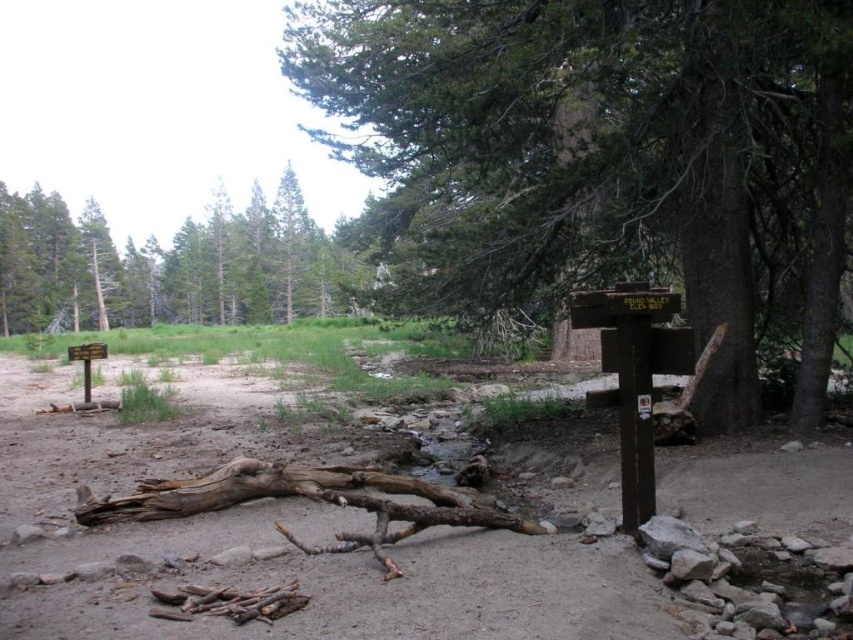
Question: Which is nearer to the green leafy tree at upper left?

Choices:
 (A) smooth brown tree trunk at center
 (B) brown dirt track at center

Answer: (A)

Question: Can you confirm if smooth brown tree trunk at center is thinner than green leafy tree at upper left?

Choices:
 (A) no
 (B) yes

Answer: (B)

Question: From the image, what is the correct spatial relationship of brown dirt track at center in relation to green leafy tree at upper left?

Choices:
 (A) below
 (B) above

Answer: (A)

Question: Which object is the closest to the green leafy tree at upper left?

Choices:
 (A) smooth brown tree trunk at center
 (B) brown dirt track at center

Answer: (A)

Question: Can you confirm if smooth brown tree trunk at center is positioned above brown dirt track at center?

Choices:
 (A) no
 (B) yes

Answer: (B)

Question: Among these objects, which one is nearest to the camera?

Choices:
 (A) green leafy tree at upper left
 (B) smooth brown tree trunk at center

Answer: (B)